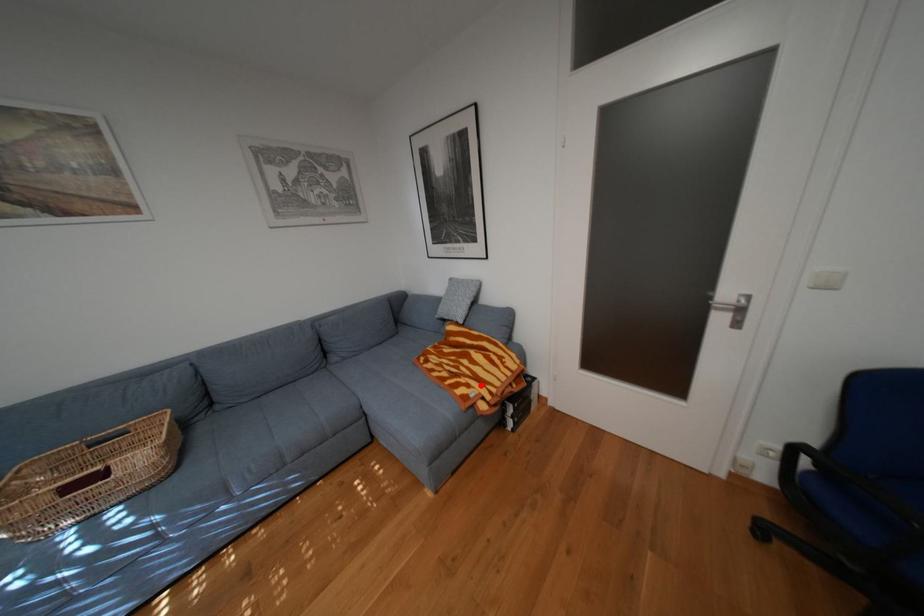
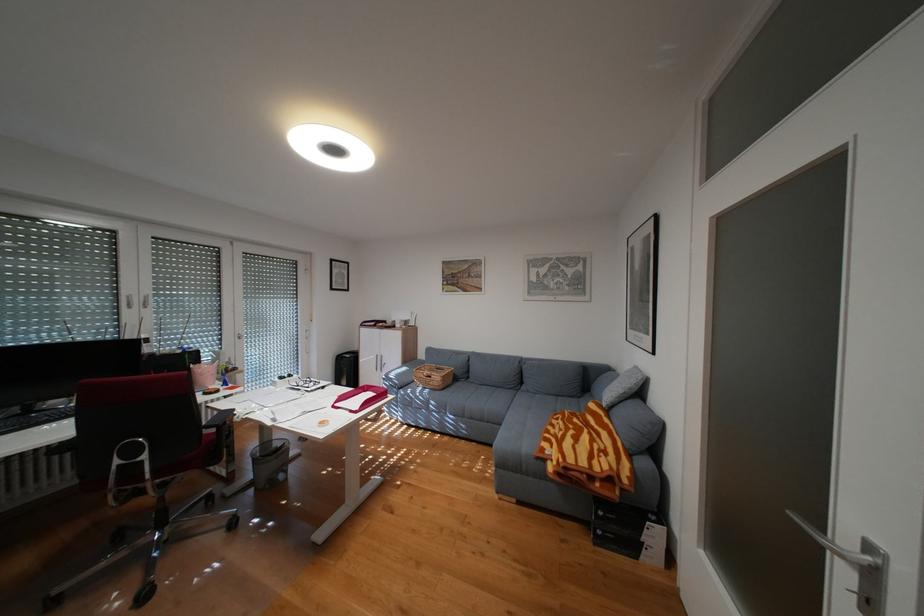
The point at the highlighted location is marked in the first image. Where is the corresponding point in the second image?

(564, 445)